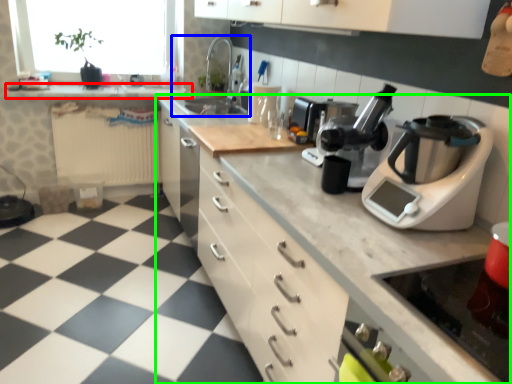
Question: Which object is the farthest from counter top (highlighted by a red box)? Choose among these: sink (highlighted by a blue box) or countertop (highlighted by a green box).

Choices:
 (A) sink
 (B) countertop

Answer: (B)